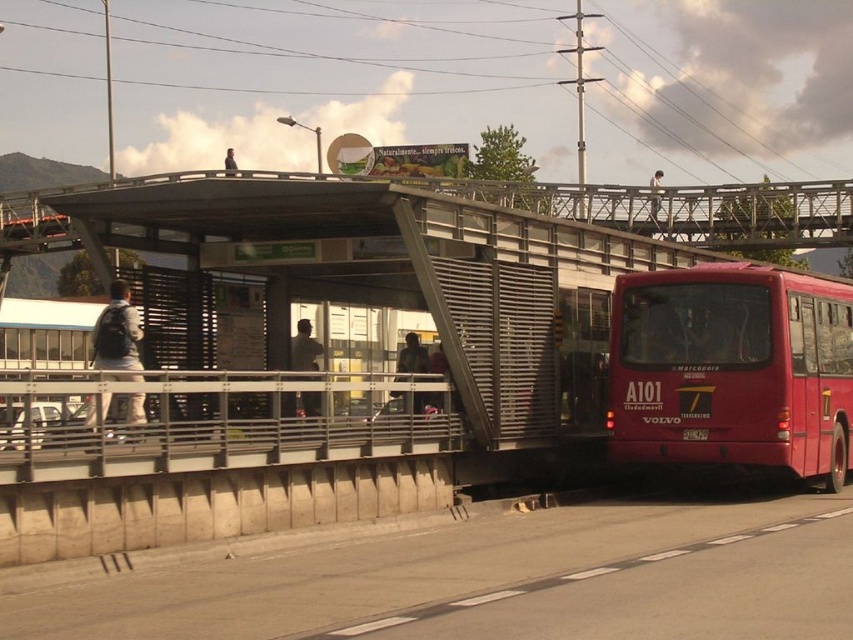
Which is behind, point (132, 356) or point (228, 172)?

Positioned behind is point (228, 172).

Does white fabric backpack at left have a greater width compared to dark gray jacket at upper center?

In fact, white fabric backpack at left might be narrower than dark gray jacket at upper center.

Is point (123, 349) closer to camera compared to point (233, 170)?

Yes.

Where is `white fabric backpack at left`? This screenshot has height=640, width=853. white fabric backpack at left is located at coordinates (117, 332).

Does red matte bus at right come behind dark gray jacket at upper center?

That is False.

What do you see at coordinates (732, 369) in the screenshot? I see `red matte bus at right` at bounding box center [732, 369].

Between point (693, 458) and point (234, 164), which one is positioned in front?

Positioned in front is point (693, 458).

You are a GUI agent. You are given a task and a screenshot of the screen. Output one action in this format:
    pyautogui.click(x=<x>, y=<y>)
    Task: Click on the red matte bus at right
    Image resolution: width=853 pixels, height=640 pixels.
    Given the screenshot: What is the action you would take?
    pyautogui.click(x=732, y=369)

The width and height of the screenshot is (853, 640). I want to click on red matte bus at right, so click(x=732, y=369).